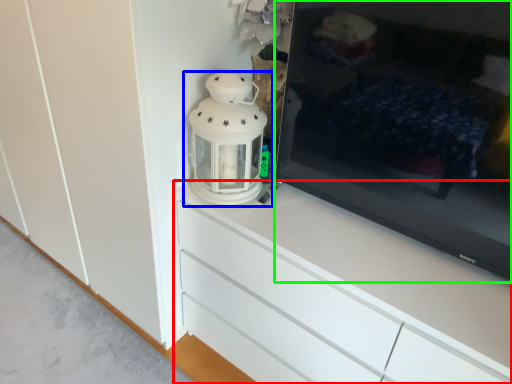
Question: Based on their relative distances, which object is farther from chest of drawers (highlighted by a red box)? Choose from lantern (highlighted by a blue box) and television (highlighted by a green box).

Choices:
 (A) lantern
 (B) television

Answer: (B)